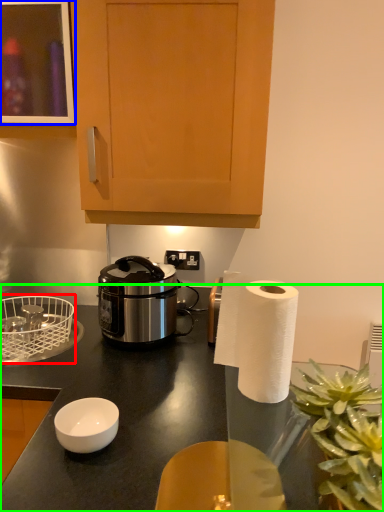
Question: Considering the real-world distances, which object is closest to basket (highlighted by a red box)? cabinetry (highlighted by a blue box) or desk (highlighted by a green box).

Choices:
 (A) cabinetry
 (B) desk

Answer: (B)